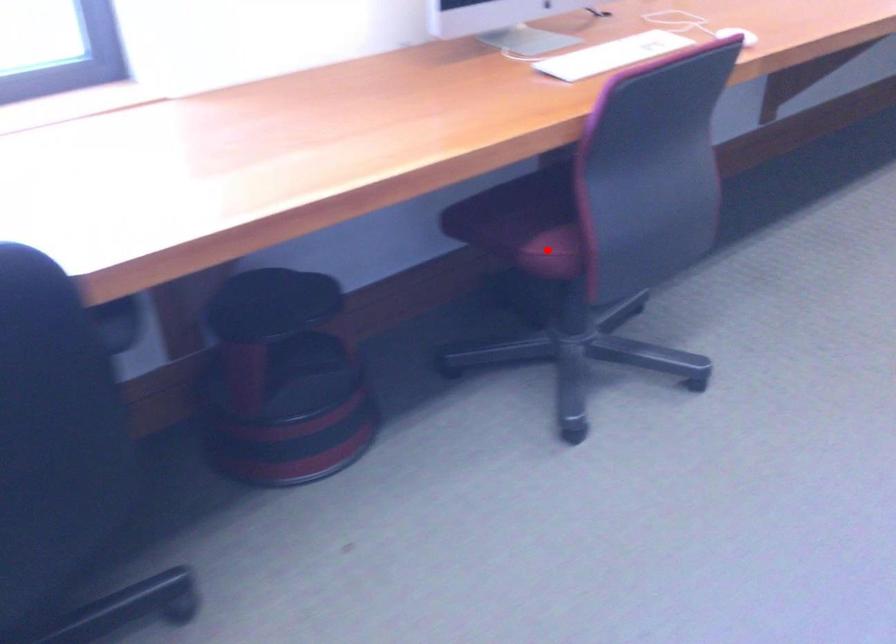
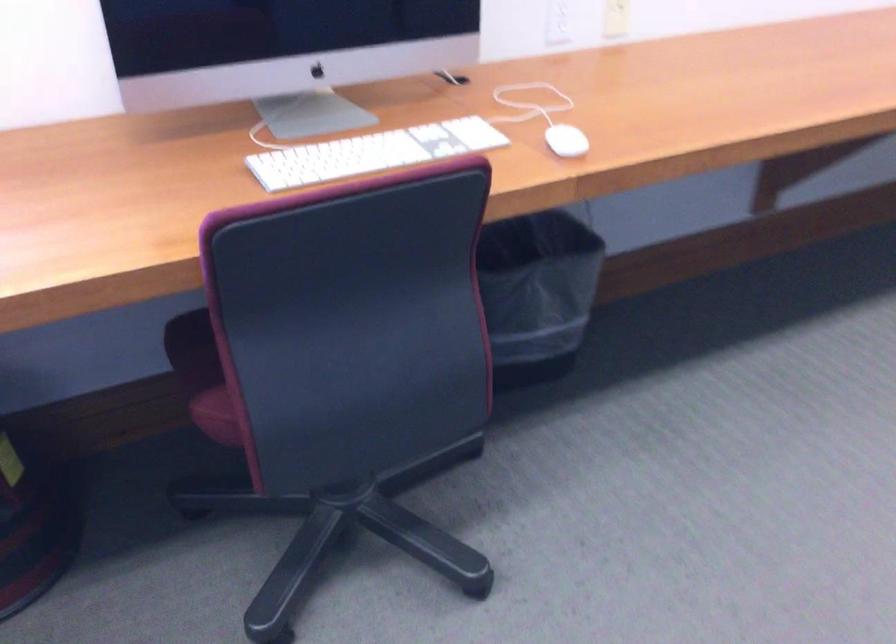
Question: I am providing you with two images of the same scene from different viewpoints. Image1 has a red point marked. In image2, the corresponding 3D location appears at what relative position? Reply with the corresponding letter.

Choices:
 (A) Closer
 (B) Farther

Answer: (A)